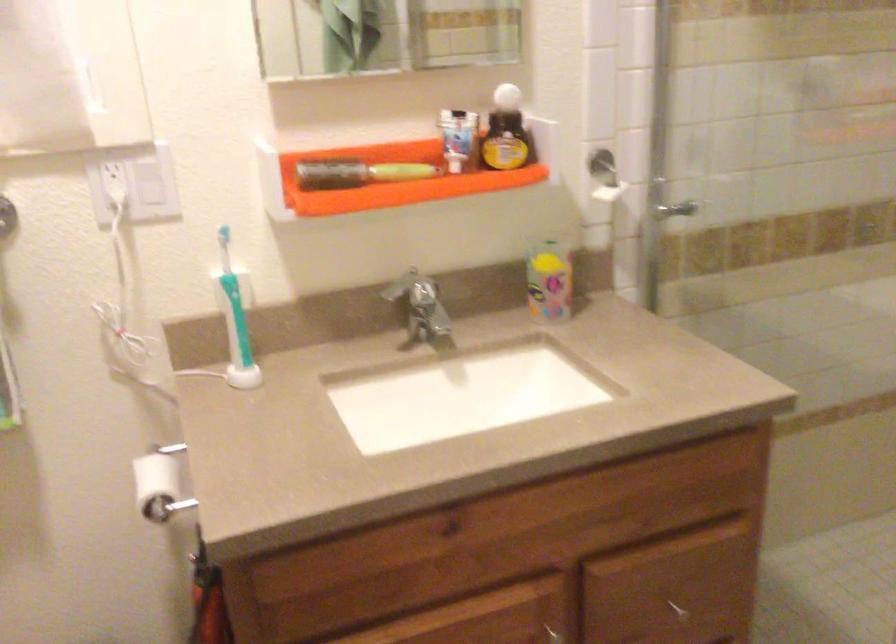
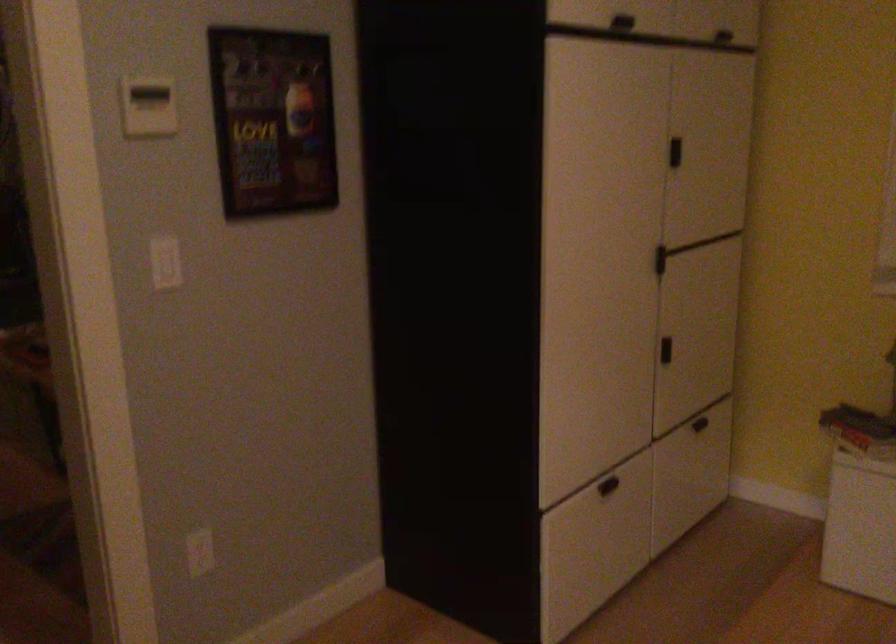
The images are taken continuously from a first-person perspective. In which direction is your viewpoint rotating?

The camera rotated toward right-down.